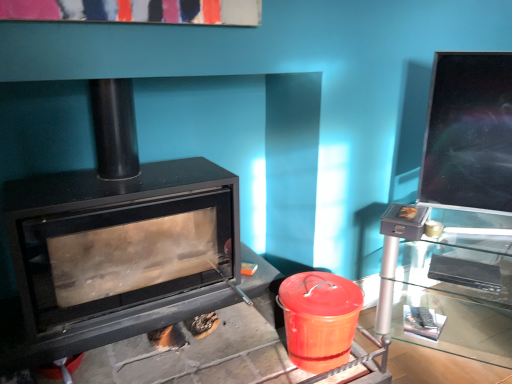
Question: From a real-world perspective, is glossy ceramic crock pot at lower right over transparent glass table at right?

Choices:
 (A) no
 (B) yes

Answer: (A)

Question: Is glossy ceramic crock pot at lower right further to camera compared to transparent glass table at right?

Choices:
 (A) yes
 (B) no

Answer: (A)

Question: Could transparent glass table at right be considered to be inside glossy ceramic crock pot at lower right?

Choices:
 (A) no
 (B) yes

Answer: (A)

Question: Is glossy ceramic crock pot at lower right at the left side of transparent glass table at right?

Choices:
 (A) no
 (B) yes

Answer: (B)

Question: Is glossy ceramic crock pot at lower right facing away from transparent glass table at right?

Choices:
 (A) no
 (B) yes

Answer: (A)

Question: Considering the positions of black matte wood burning stove at left and transparent glass table at right in the image, is black matte wood burning stove at left bigger or smaller than transparent glass table at right?

Choices:
 (A) big
 (B) small

Answer: (A)

Question: Is black matte wood burning stove at left taller or shorter than transparent glass table at right?

Choices:
 (A) short
 (B) tall

Answer: (B)

Question: In terms of width, does black matte wood burning stove at left look wider or thinner when compared to transparent glass table at right?

Choices:
 (A) thin
 (B) wide

Answer: (B)

Question: From the image's perspective, relative to transparent glass table at right, is black matte wood burning stove at left above or below?

Choices:
 (A) below
 (B) above

Answer: (B)

Question: Would you say glossy ceramic crock pot at lower right is to the left or to the right of transparent glass table at right in the picture?

Choices:
 (A) left
 (B) right

Answer: (A)

Question: Does point (333, 311) appear closer or farther from the camera than point (457, 334)?

Choices:
 (A) farther
 (B) closer

Answer: (B)

Question: From a real-world perspective, is glossy ceramic crock pot at lower right above or below transparent glass table at right?

Choices:
 (A) below
 (B) above

Answer: (A)

Question: Is glossy ceramic crock pot at lower right in front of or behind transparent glass table at right in the image?

Choices:
 (A) front
 (B) behind

Answer: (B)

Question: Would you say black matte wood burning stove at left is to the left or to the right of glossy ceramic crock pot at lower right in the picture?

Choices:
 (A) right
 (B) left

Answer: (B)

Question: Relative to glossy ceramic crock pot at lower right, is black matte wood burning stove at left in front or behind?

Choices:
 (A) behind
 (B) front

Answer: (B)